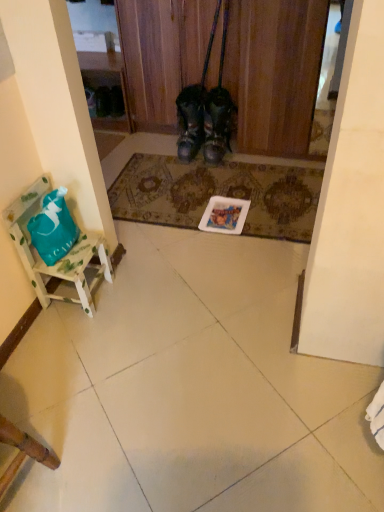
Locate an element on the screen. Image resolution: width=384 pixels, height=512 pixels. free point in front of white wood chair at left is located at coordinates (70, 340).